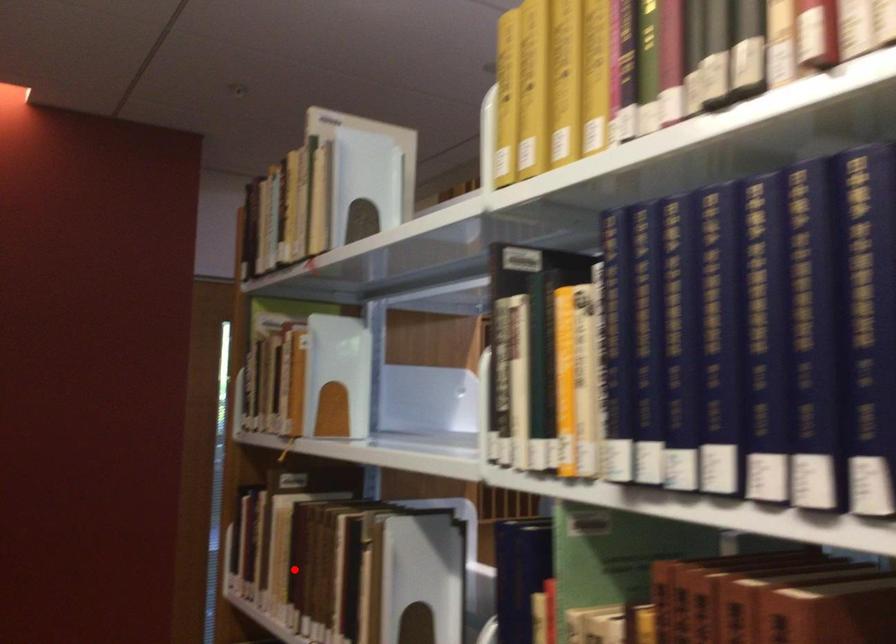
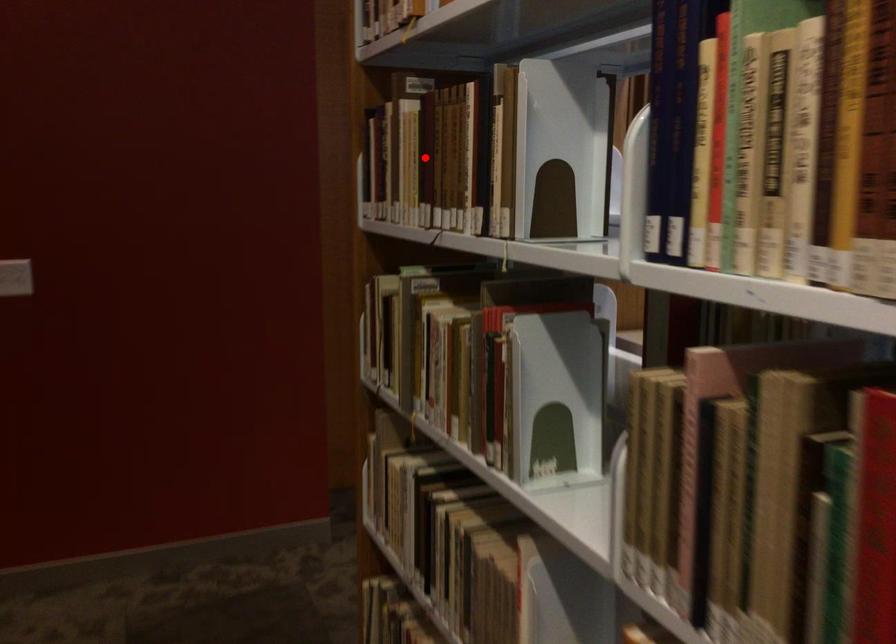
I am providing you with two images of the same scene from different viewpoints. A red point is marked on the first image and another point is marked on the second image. Is the marked point in image1 the same physical position as the marked point in image2?

Yes